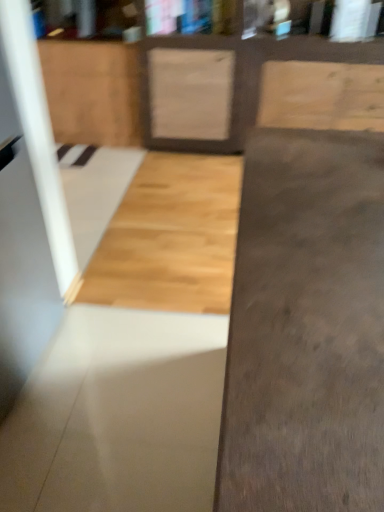
Describe the element at coordinates (118, 415) in the screenshot. The width and height of the screenshot is (384, 512). I see `smooth concrete at center, the second concrete in the front-to-back sequence` at that location.

This screenshot has width=384, height=512. I want to click on natural wood cabinet at upper left, so point(92,91).

From the image's perspective, would you say gray concrete at center, acting as the second concrete starting from the back, is shown under natural wood cabinet at upper left?

Yes.

In terms of height, does gray concrete at center, the 1th concrete from the front, look taller or shorter compared to natural wood cabinet at upper left?

Clearly, gray concrete at center, the 1th concrete from the front, is taller compared to natural wood cabinet at upper left.

Could you tell me if gray concrete at center, the 1th concrete from the front, is turned towards natural wood cabinet at upper left?

No, gray concrete at center, the 1th concrete from the front, is not turned towards natural wood cabinet at upper left.

Is point (370, 423) closer or farther from the camera than point (67, 57)?

Point (370, 423) is positioned closer to the camera compared to point (67, 57).

Is natural wood cabinet at upper left not within gray concrete at center, acting as the second concrete starting from the back?

Indeed, natural wood cabinet at upper left is completely outside gray concrete at center, acting as the second concrete starting from the back.

Which of these two, natural wood cabinet at upper left or gray concrete at center, acting as the second concrete starting from the back, is wider?

gray concrete at center, acting as the second concrete starting from the back.

Does natural wood cabinet at upper left have a greater height compared to gray concrete at center, acting as the second concrete starting from the back?

No, natural wood cabinet at upper left is not taller than gray concrete at center, acting as the second concrete starting from the back.

Can you confirm if natural wood cabinet at upper left is smaller than smooth concrete at center, the second concrete in the front-to-back sequence?

Yes, natural wood cabinet at upper left is smaller than smooth concrete at center, the second concrete in the front-to-back sequence.

From the image's perspective, is natural wood cabinet at upper left under smooth concrete at center, the second concrete in the front-to-back sequence?

No, from the image's perspective, natural wood cabinet at upper left is not below smooth concrete at center, the second concrete in the front-to-back sequence.

From a real-world perspective, is natural wood cabinet at upper left on top of smooth concrete at center, the first concrete in the back-to-front sequence?

Correct, in the physical world, natural wood cabinet at upper left is higher than smooth concrete at center, the first concrete in the back-to-front sequence.

Between smooth concrete at center, the second concrete in the front-to-back sequence, and natural wood cabinet at upper left, which one has larger width?

smooth concrete at center, the second concrete in the front-to-back sequence, is wider.

Is smooth concrete at center, the first concrete in the back-to-front sequence, positioned far away from natural wood cabinet at upper left?

Absolutely, smooth concrete at center, the first concrete in the back-to-front sequence, is distant from natural wood cabinet at upper left.

Is smooth concrete at center, the first concrete in the back-to-front sequence, oriented towards natural wood cabinet at upper left?

No.

Between smooth concrete at center, the second concrete in the front-to-back sequence, and gray concrete at center, acting as the second concrete starting from the back, which one has less height?

smooth concrete at center, the second concrete in the front-to-back sequence, is shorter.

Is smooth concrete at center, the first concrete in the back-to-front sequence, completely or partially outside of gray concrete at center, acting as the second concrete starting from the back?

That's correct, smooth concrete at center, the first concrete in the back-to-front sequence, is outside of gray concrete at center, acting as the second concrete starting from the back.

Can you confirm if smooth concrete at center, the first concrete in the back-to-front sequence, is bigger than gray concrete at center, acting as the second concrete starting from the back?

Incorrect, smooth concrete at center, the first concrete in the back-to-front sequence, is not larger than gray concrete at center, acting as the second concrete starting from the back.

Can you confirm if smooth concrete at center, the first concrete in the back-to-front sequence, is wider than gray concrete at center, acting as the second concrete starting from the back?

Yes.

Can you confirm if gray concrete at center, acting as the second concrete starting from the back, is bigger than smooth concrete at center, the second concrete in the front-to-back sequence?

Yes, gray concrete at center, acting as the second concrete starting from the back, is bigger than smooth concrete at center, the second concrete in the front-to-back sequence.

From the image's perspective, which is below, gray concrete at center, acting as the second concrete starting from the back, or smooth concrete at center, the second concrete in the front-to-back sequence?

gray concrete at center, acting as the second concrete starting from the back, appears lower in the image.

Considering the positions of objects gray concrete at center, acting as the second concrete starting from the back, and smooth concrete at center, the second concrete in the front-to-back sequence, in the image provided, who is behind, gray concrete at center, acting as the second concrete starting from the back, or smooth concrete at center, the second concrete in the front-to-back sequence,?

smooth concrete at center, the second concrete in the front-to-back sequence, is more distant.

Is gray concrete at center, the 1th concrete from the front, directly adjacent to smooth concrete at center, the first concrete in the back-to-front sequence?

No, gray concrete at center, the 1th concrete from the front, is not in contact with smooth concrete at center, the first concrete in the back-to-front sequence.

Find the location of a particular element. The height and width of the screenshot is (512, 384). cabinetry located underneath the gray concrete at center, acting as the second concrete starting from the back (from a real-world perspective) is located at coordinates (92, 91).

The height and width of the screenshot is (512, 384). In order to click on concrete that is the 2nd object located in front of the natural wood cabinet at upper left in this screenshot , I will do `click(306, 328)`.

When comparing their distances from smooth concrete at center, the first concrete in the back-to-front sequence, does natural wood cabinet at upper left or gray concrete at center, the 1th concrete from the front, seem closer?

gray concrete at center, the 1th concrete from the front, lies closer to smooth concrete at center, the first concrete in the back-to-front sequence, than the other object.

Based on their spatial positions, is gray concrete at center, acting as the second concrete starting from the back, or natural wood cabinet at upper left closer to smooth concrete at center, the second concrete in the front-to-back sequence?

Among the two, gray concrete at center, acting as the second concrete starting from the back, is located nearer to smooth concrete at center, the second concrete in the front-to-back sequence.

Which object lies nearer to the anchor point gray concrete at center, the 1th concrete from the front, natural wood cabinet at upper left or smooth concrete at center, the second concrete in the front-to-back sequence?

Among the two, smooth concrete at center, the second concrete in the front-to-back sequence, is located nearer to gray concrete at center, the 1th concrete from the front.

Considering their positions, is smooth concrete at center, the second concrete in the front-to-back sequence, positioned further to natural wood cabinet at upper left than gray concrete at center, the 1th concrete from the front?

gray concrete at center, the 1th concrete from the front, is positioned further to the anchor natural wood cabinet at upper left.

Estimate the real-world distances between objects in this image. Which object is closer to gray concrete at center, acting as the second concrete starting from the back, smooth concrete at center, the second concrete in the front-to-back sequence, or natural wood cabinet at upper left?

Among the two, smooth concrete at center, the second concrete in the front-to-back sequence, is located nearer to gray concrete at center, acting as the second concrete starting from the back.

Which object lies further to the anchor point natural wood cabinet at upper left, gray concrete at center, acting as the second concrete starting from the back, or smooth concrete at center, the first concrete in the back-to-front sequence?

gray concrete at center, acting as the second concrete starting from the back, is positioned further to the anchor natural wood cabinet at upper left.

Locate an element on the screen. concrete between gray concrete at center, acting as the second concrete starting from the back, and natural wood cabinet at upper left, along the z-axis is located at coordinates (118, 415).